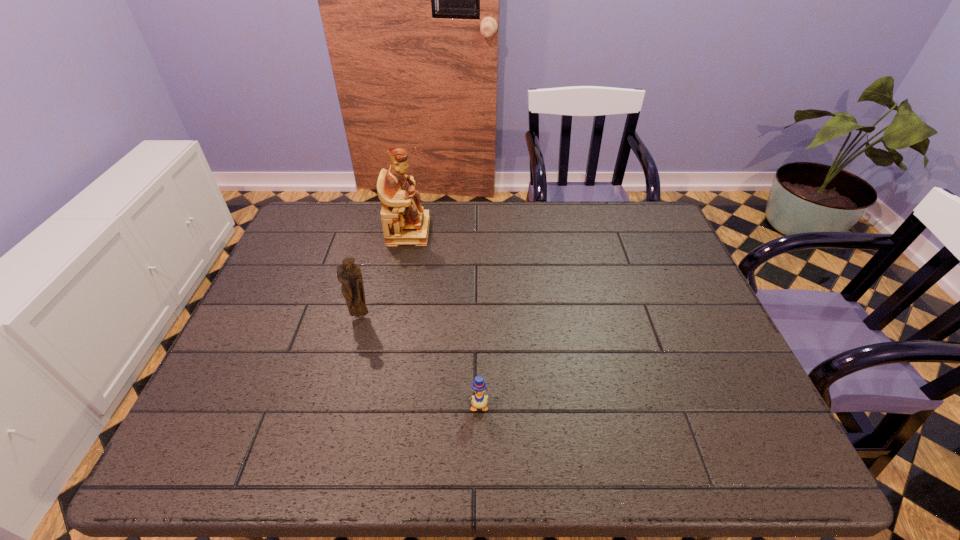
Where is `free space that satisfies the following two spatial constraints: 1. on the front-facing side of the farther figurine; 2. on the front-facing side of the shorter figurine`? free space that satisfies the following two spatial constraints: 1. on the front-facing side of the farther figurine; 2. on the front-facing side of the shorter figurine is located at coordinates (392, 316).